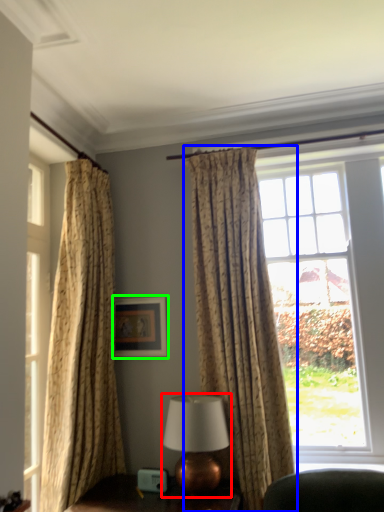
Question: Which object is the farthest from table lamp (highlighted by a red box)? Choose among these: curtain (highlighted by a blue box) or picture frame (highlighted by a green box).

Choices:
 (A) curtain
 (B) picture frame

Answer: (B)